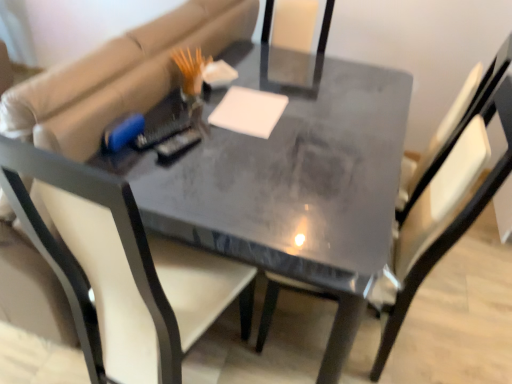
You are a GUI agent. You are given a task and a screenshot of the screen. Output one action in this format:
    pyautogui.click(x=<x>, y=<y>)
    Task: Click on the free space in front of white matte notepad at center
    The image size is (512, 384).
    Given the screenshot: What is the action you would take?
    pyautogui.click(x=253, y=150)